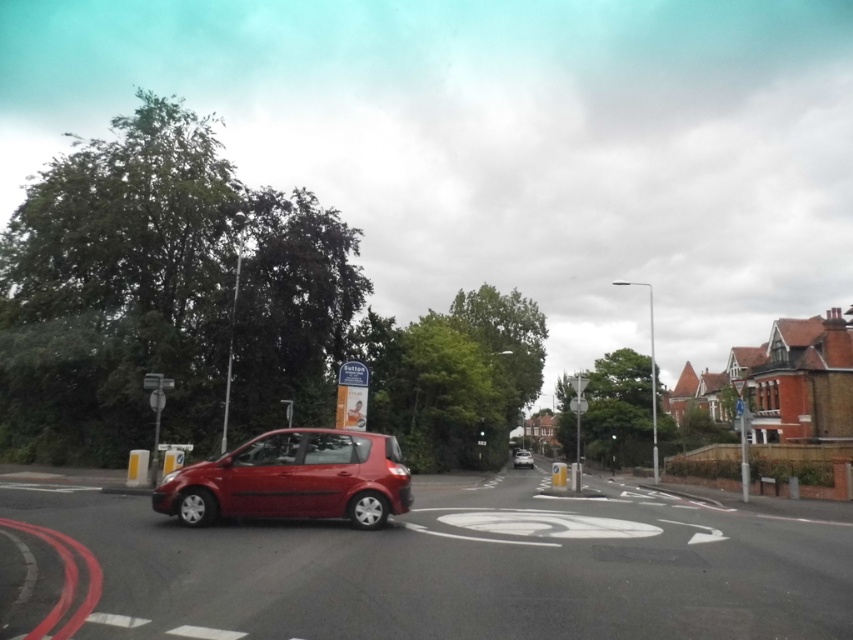
You are a pedestrian standing at the edge of the roundabout and want to cross to the other side. There are two cars in your path. The shiny metallic car at lower left and the metallic silver hatchback at center. Which car is closer to you?

The shiny metallic car at lower left is closer to you since it is positioned in front of the metallic silver hatchback at center in the image.